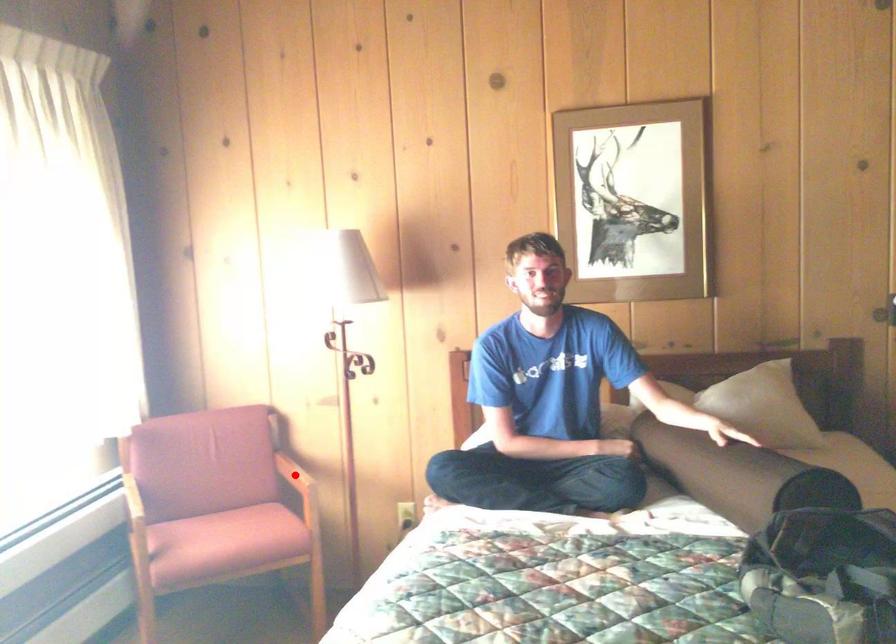
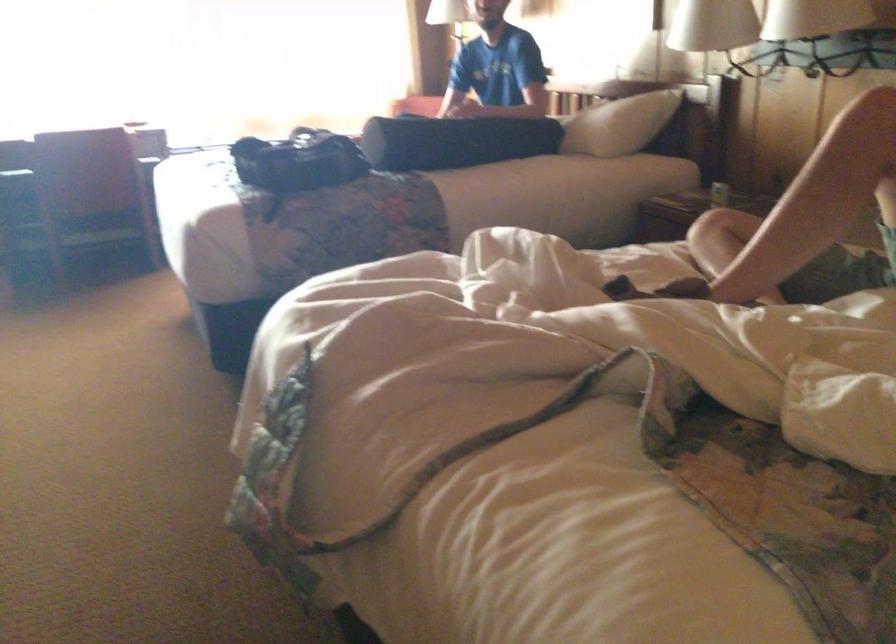
Question: I am providing you with two images of the same scene from different viewpoints. A red point is marked on the first image. Can you still see the location of the red point in image 2?

Choices:
 (A) Yes
 (B) No

Answer: (B)